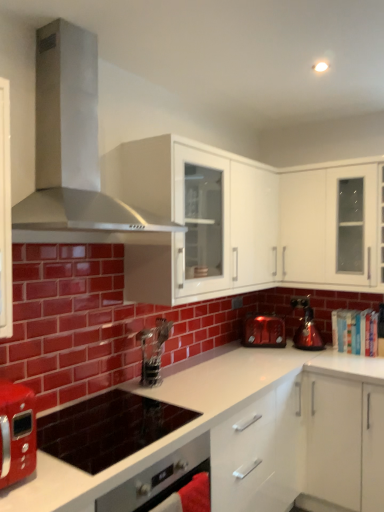
Find the location of a particular element. empty space that is ontop of matte red toaster at center, placed as the 2th kitchen appliance when sorted from right to left (from a real-world perspective) is located at coordinates (259, 316).